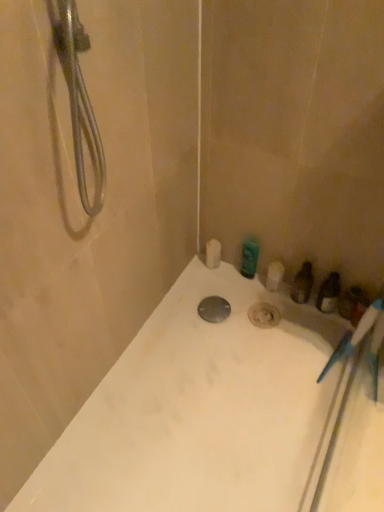
The height and width of the screenshot is (512, 384). Find the location of `vacant area that lies between green glossy bottle at upper right, placed as the 1th toiletry when sorted from top to bottom, and metallic silver drain at center`. vacant area that lies between green glossy bottle at upper right, placed as the 1th toiletry when sorted from top to bottom, and metallic silver drain at center is located at coordinates pyautogui.click(x=231, y=294).